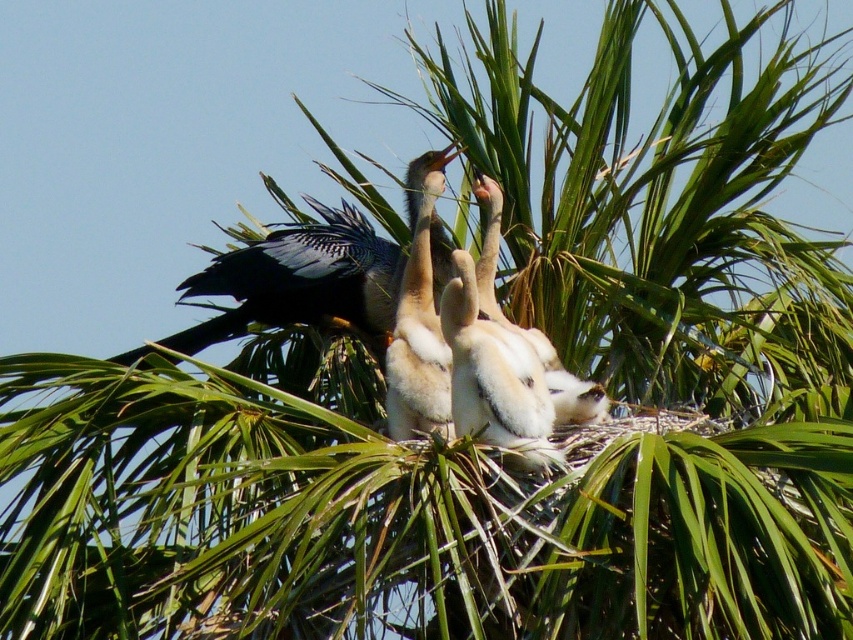
Is white fluffy nestling at center shorter than white downy feathers at center?

Incorrect, white fluffy nestling at center's height does not fall short of white downy feathers at center's.

Between white fluffy nestling at center and white downy feathers at center, which one is positioned higher?

white fluffy nestling at center

Find the location of a particular element. This screenshot has width=853, height=640. white fluffy nestling at center is located at coordinates (494, 376).

Consider the image. Which is more to the left, blue-gray feathers at center or white fluffy nestling at center?

blue-gray feathers at center is more to the left.

Does blue-gray feathers at center appear over white fluffy nestling at center?

No.

Does point (331, 280) come closer to viewer compared to point (462, 284)?

That is False.

This screenshot has height=640, width=853. What are the coordinates of `blue-gray feathers at center` in the screenshot? It's located at (300, 280).

Does point (228, 284) lie behind point (415, 326)?

Yes.

Is blue-gray feathers at center wider than white downy feathers at center?

No, blue-gray feathers at center is not wider than white downy feathers at center.

Is point (265, 237) more distant than point (438, 339)?

Yes, it is.

Locate an element on the screen. The height and width of the screenshot is (640, 853). blue-gray feathers at center is located at coordinates (300, 280).